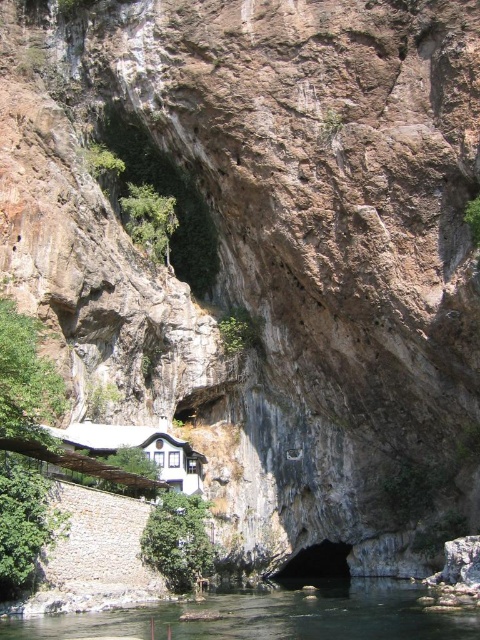
Does point (155, 451) come farther from viewer compared to point (310, 563)?

No.

This screenshot has height=640, width=480. I want to click on white matte house at lower center, so click(139, 449).

How distant is clear water at lower center from white matte house at lower center?

They are 20.52 meters apart.

Looking at this image, does clear water at lower center lie behind white matte house at lower center?

That is False.

Find the location of a particular element. clear water at lower center is located at coordinates (268, 616).

Is clear water at lower center positioned in front of black rock cave at center?

Yes, clear water at lower center is in front of black rock cave at center.

At what (x,y) coordinates should I click in order to perform the action: click on clear water at lower center. Please return your answer as a coordinate pair (x, y). The image size is (480, 640). Looking at the image, I should click on (268, 616).

At what (x,y) coordinates should I click in order to perform the action: click on clear water at lower center. Please return your answer as a coordinate pair (x, y). The height and width of the screenshot is (640, 480). Looking at the image, I should click on (268, 616).